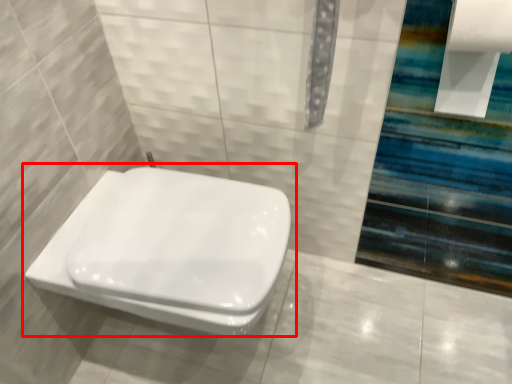
Question: Observing the image, what is the correct spatial positioning of toilet (annotated by the red box) in reference to toilet paper?

Choices:
 (A) right
 (B) left

Answer: (B)